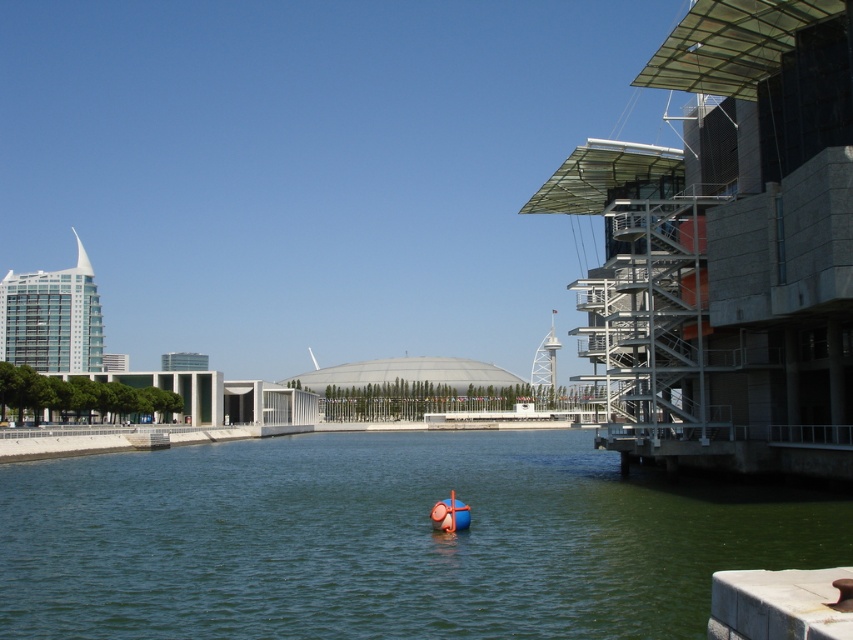
Question: Is green water at center bigger than orange rubber boat at center?

Choices:
 (A) yes
 (B) no

Answer: (A)

Question: Which point is farther to the camera?

Choices:
 (A) orange rubber boat at center
 (B) green water at center

Answer: (A)

Question: From the image, what is the correct spatial relationship of green water at center in relation to orange rubber boat at center?

Choices:
 (A) right
 (B) left

Answer: (B)

Question: Can you confirm if green water at center is positioned to the left of orange rubber boat at center?

Choices:
 (A) yes
 (B) no

Answer: (A)

Question: Which of the following is the farthest from the observer?

Choices:
 (A) orange rubber boat at center
 (B) green water at center

Answer: (A)